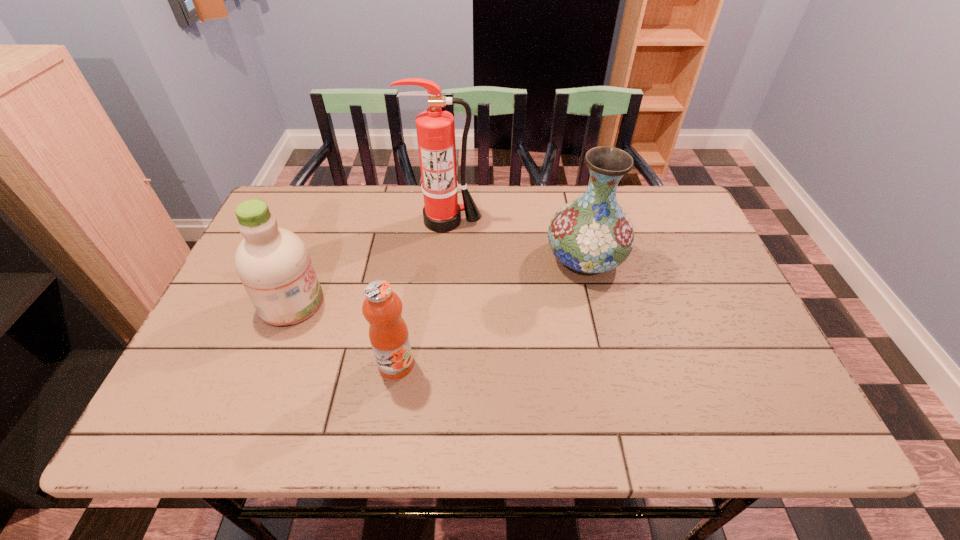
Where is `free space between the leftmost object and the vase`? free space between the leftmost object and the vase is located at coordinates (439, 281).

You are a GUI agent. You are given a task and a screenshot of the screen. Output one action in this format:
    pyautogui.click(x=<x>, y=<y>)
    Task: Click on the vacant point located between the rightmost object and the tallest object
    This screenshot has width=960, height=540.
    Given the screenshot: What is the action you would take?
    pyautogui.click(x=516, y=240)

Where is `blank region between the vase and the cleansing agent`? This screenshot has width=960, height=540. blank region between the vase and the cleansing agent is located at coordinates (439, 281).

Identify the location of vacant space that is in between the tallest object and the fruit juice. The width and height of the screenshot is (960, 540). (420, 293).

You are a GUI agent. You are given a task and a screenshot of the screen. Output one action in this format:
    pyautogui.click(x=<x>, y=<y>)
    Task: Click on the free spot between the rightmost object and the tallest object
    This screenshot has height=540, width=960.
    Given the screenshot: What is the action you would take?
    tap(516, 240)

This screenshot has width=960, height=540. In order to click on free space between the fire extinguisher and the leftmost object in this screenshot , I will do `click(369, 262)`.

Image resolution: width=960 pixels, height=540 pixels. Identify the location of empty space between the leftmost object and the fire extinguisher. (369, 262).

The height and width of the screenshot is (540, 960). Find the location of `empty space that is in between the fire extinguisher and the vase`. empty space that is in between the fire extinguisher and the vase is located at coordinates (516, 240).

Find the location of `free space that is in between the shortest object and the fire extinguisher`. free space that is in between the shortest object and the fire extinguisher is located at coordinates (420, 293).

This screenshot has width=960, height=540. Identify the location of object that is the third closest to the tallest object. (382, 308).